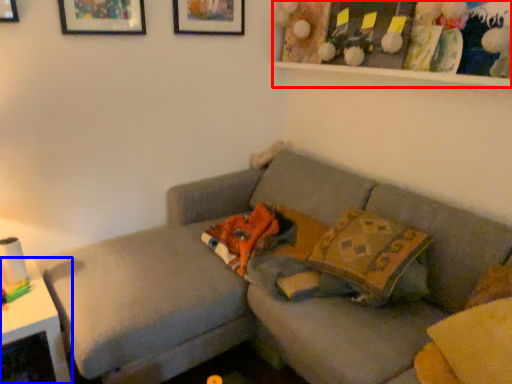
Question: Which of the following is the closest to the observer, shelf (highlighted by a red box) or table (highlighted by a blue box)?

Choices:
 (A) shelf
 (B) table

Answer: (A)